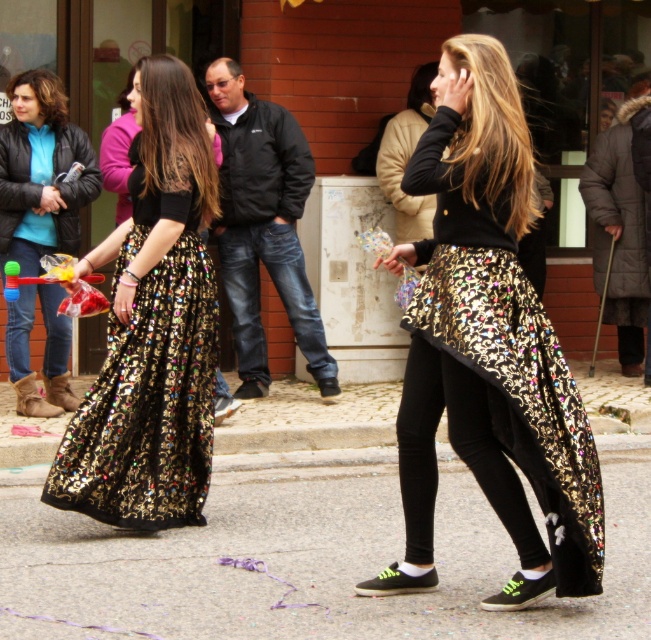
Question: Which of these objects is positioned closest to the shiny metallic skirt at left?

Choices:
 (A) shiny sequined skirt at center
 (B) shiny asphalt pavement at center

Answer: (B)

Question: Does shiny asphalt pavement at center lie in front of shiny metallic skirt at left?

Choices:
 (A) no
 (B) yes

Answer: (B)

Question: Is shiny asphalt pavement at center to the left of shiny metallic skirt at left from the viewer's perspective?

Choices:
 (A) no
 (B) yes

Answer: (A)

Question: Can you confirm if shiny sequined skirt at center is wider than shiny metallic skirt at left?

Choices:
 (A) yes
 (B) no

Answer: (A)

Question: Which point is farther from the camera taking this photo?

Choices:
 (A) (449, 513)
 (B) (572, 499)
 (C) (126, 486)

Answer: (A)

Question: Which point is farther to the camera?

Choices:
 (A) (33, 529)
 (B) (76, 440)
 (C) (436, 84)

Answer: (A)